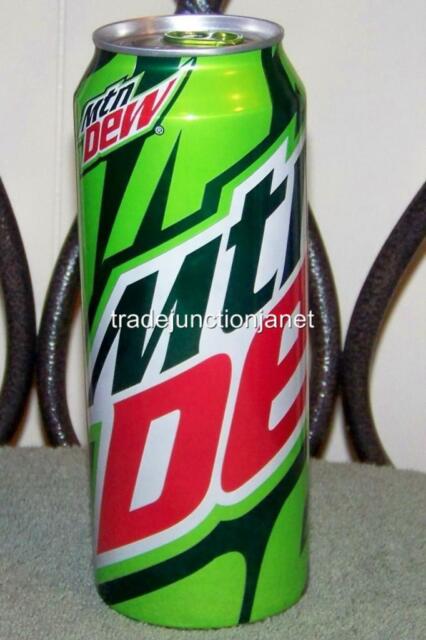
Where is `table where can on`? table where can on is located at coordinates click(x=43, y=524).